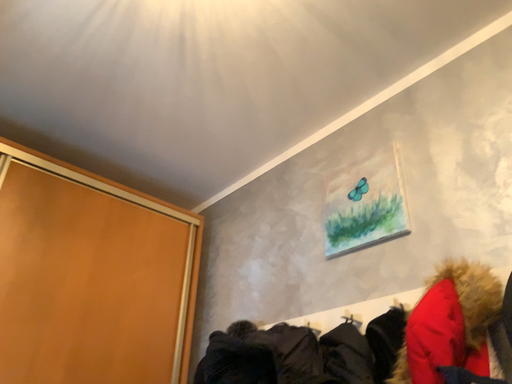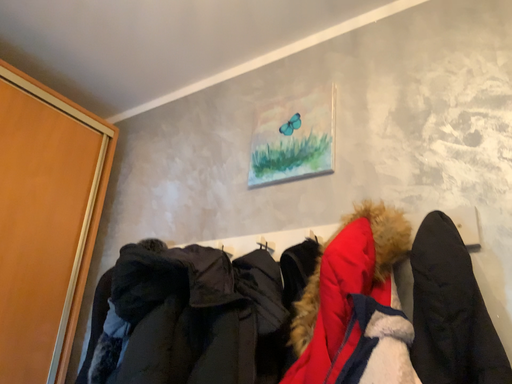
Question: How did the camera likely rotate when shooting the video?

Choices:
 (A) rotated right
 (B) rotated left

Answer: (A)